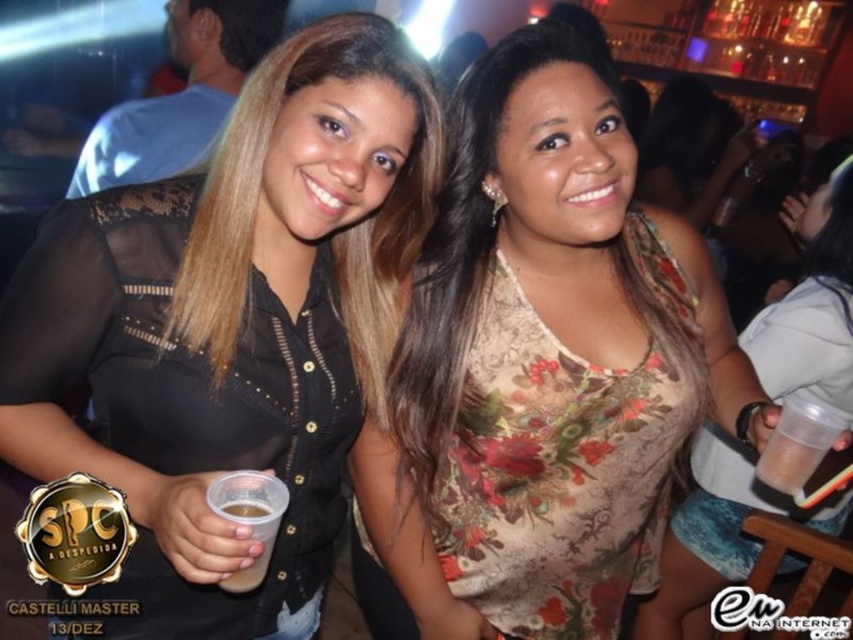
Where is the black lace shirt at left located in the image?

The black lace shirt at left is located at the 2D coordinates point (230, 330) in the image.